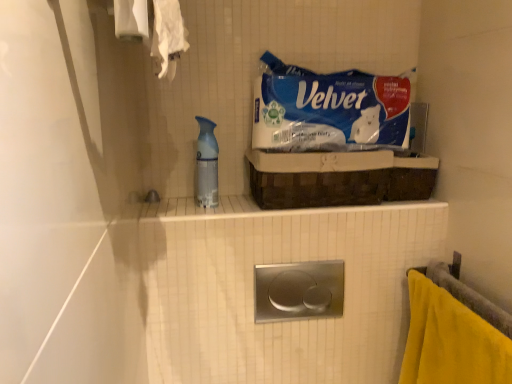
Question: From the image's perspective, would you say translucent plastic spray bottle at center is shown under yellow fabric towel at lower right?

Choices:
 (A) yes
 (B) no

Answer: (B)

Question: From the image's perspective, would you say translucent plastic spray bottle at center is positioned over yellow fabric towel at lower right?

Choices:
 (A) yes
 (B) no

Answer: (A)

Question: Is translucent plastic spray bottle at center wider than yellow fabric towel at lower right?

Choices:
 (A) no
 (B) yes

Answer: (A)

Question: Is translucent plastic spray bottle at center positioned with its back to yellow fabric towel at lower right?

Choices:
 (A) yes
 (B) no

Answer: (B)

Question: Is translucent plastic spray bottle at center closer to the viewer compared to yellow fabric towel at lower right?

Choices:
 (A) yes
 (B) no

Answer: (B)

Question: Do you think yellow fabric towel at lower right is within brown woven basket at upper center, or outside of it?

Choices:
 (A) outside
 (B) inside

Answer: (A)

Question: From a real-world perspective, is yellow fabric towel at lower right above or below brown woven basket at upper center?

Choices:
 (A) below
 (B) above

Answer: (A)

Question: Is yellow fabric towel at lower right taller or shorter than brown woven basket at upper center?

Choices:
 (A) tall
 (B) short

Answer: (A)

Question: Considering the positions of yellow fabric towel at lower right and brown woven basket at upper center in the image, is yellow fabric towel at lower right bigger or smaller than brown woven basket at upper center?

Choices:
 (A) big
 (B) small

Answer: (A)

Question: From a real-world perspective, is brown woven basket at upper center physically located above or below blue paper towel at upper center?

Choices:
 (A) above
 (B) below

Answer: (B)

Question: From the image's perspective, relative to blue paper towel at upper center, is brown woven basket at upper center above or below?

Choices:
 (A) below
 (B) above

Answer: (A)

Question: In terms of size, does brown woven basket at upper center appear bigger or smaller than blue paper towel at upper center?

Choices:
 (A) small
 (B) big

Answer: (B)

Question: Looking at their shapes, would you say brown woven basket at upper center is wider or thinner than blue paper towel at upper center?

Choices:
 (A) thin
 (B) wide

Answer: (B)

Question: Is yellow fabric towel at lower right spatially inside blue paper towel at upper center, or outside of it?

Choices:
 (A) inside
 (B) outside

Answer: (B)

Question: Based on their positions, is yellow fabric towel at lower right located to the left or right of blue paper towel at upper center?

Choices:
 (A) left
 (B) right

Answer: (B)